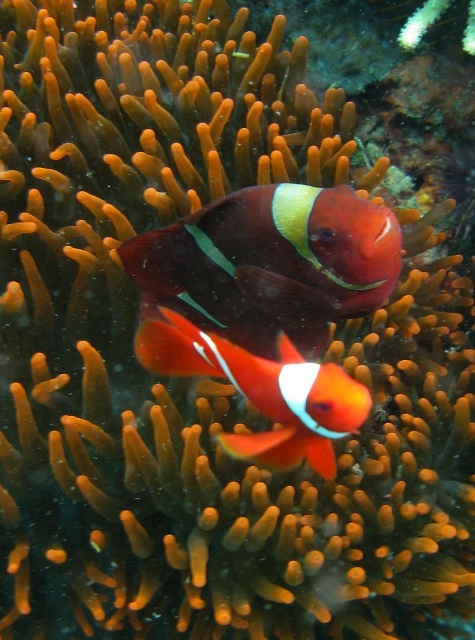
Question: Can you confirm if shiny red clownfish at center is positioned below orange matte clownfish at center?

Choices:
 (A) no
 (B) yes

Answer: (A)

Question: Which point appears closest to the camera in this image?

Choices:
 (A) (353, 200)
 (B) (226, 445)

Answer: (A)

Question: From the image, what is the correct spatial relationship of shiny red clownfish at center in relation to orange matte clownfish at center?

Choices:
 (A) above
 (B) below

Answer: (A)

Question: Does shiny red clownfish at center appear over orange matte clownfish at center?

Choices:
 (A) yes
 (B) no

Answer: (A)